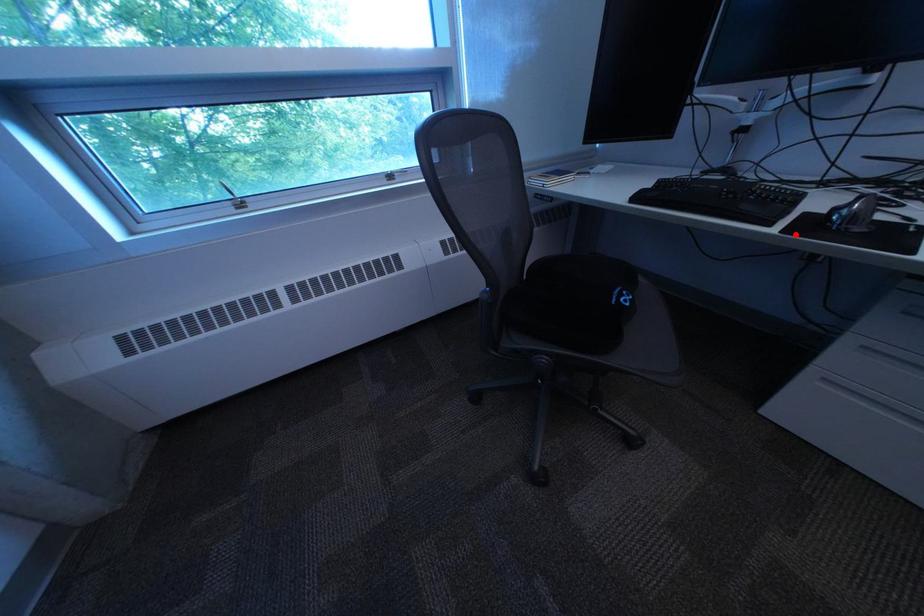
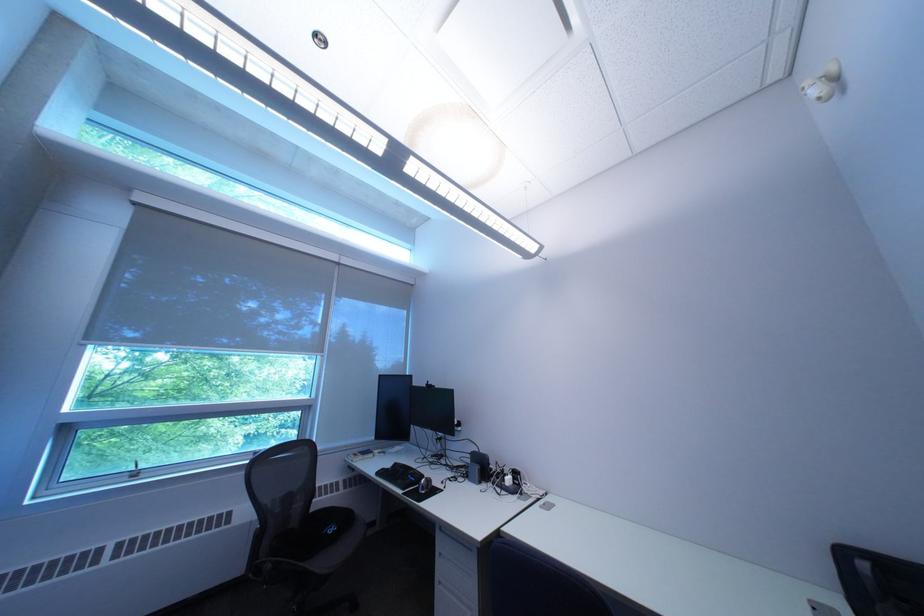
Find the pixel in the second image that matches the highlighted location in the first image.

(418, 495)